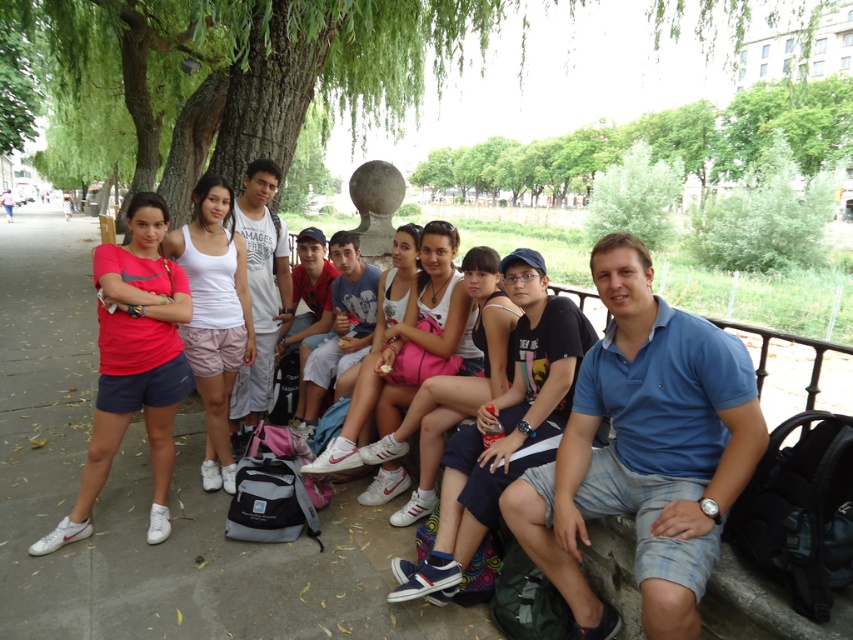
Question: Can you confirm if green leafy tree at upper left is positioned to the left of white cotton shirt at center?

Choices:
 (A) yes
 (B) no

Answer: (B)

Question: Among these points, which one is nearest to the camera?

Choices:
 (A) (517, 428)
 (B) (399, 436)

Answer: (A)

Question: Which point is closer to the camera?

Choices:
 (A) (344, 339)
 (B) (607, 627)
 (C) (416, 392)

Answer: (B)

Question: Which point is closer to the camera taking this photo?

Choices:
 (A) (624, 461)
 (B) (466, 284)
 (C) (308, 397)
 (D) (476, 461)

Answer: (A)

Question: Does green leafy tree at upper left have a smaller size compared to dark blue denim shorts at center?

Choices:
 (A) yes
 (B) no

Answer: (B)

Question: Can you confirm if blue cotton polo shirt at center is positioned to the left of white cotton shirt at center?

Choices:
 (A) yes
 (B) no

Answer: (B)